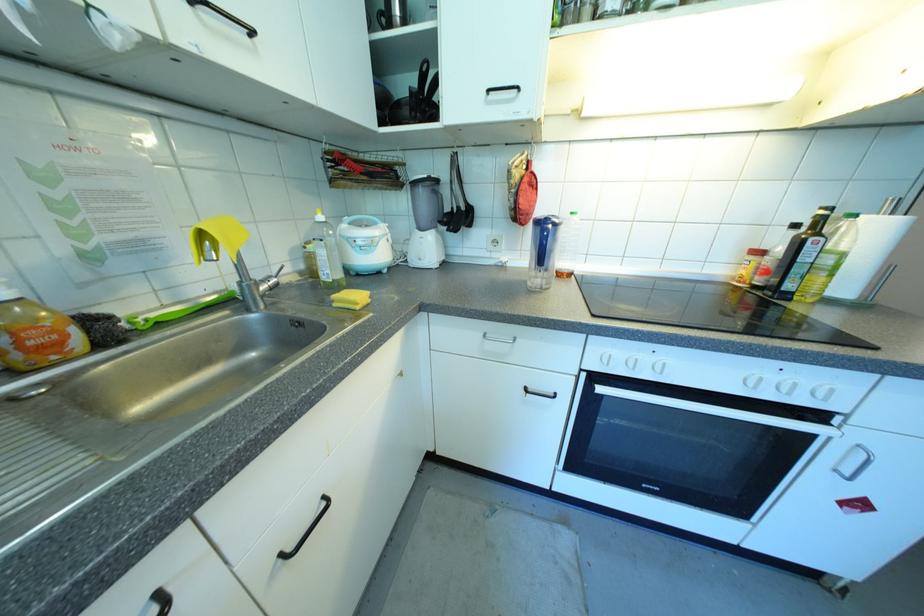
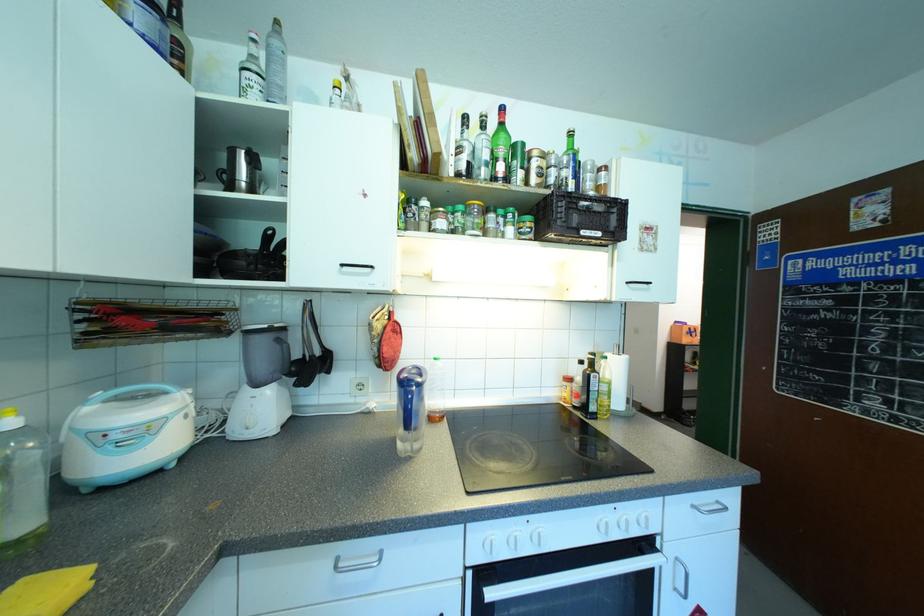
In the second image, find the point that corresponds to pixel 760 378 in the first image.

(606, 523)